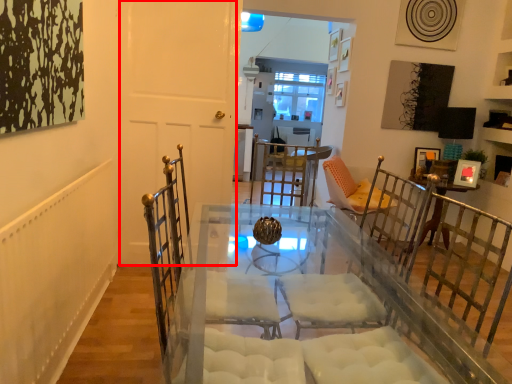
Question: Observing the image, what is the correct spatial positioning of door (annotated by the red box) in reference to picture frame?

Choices:
 (A) right
 (B) left

Answer: (B)